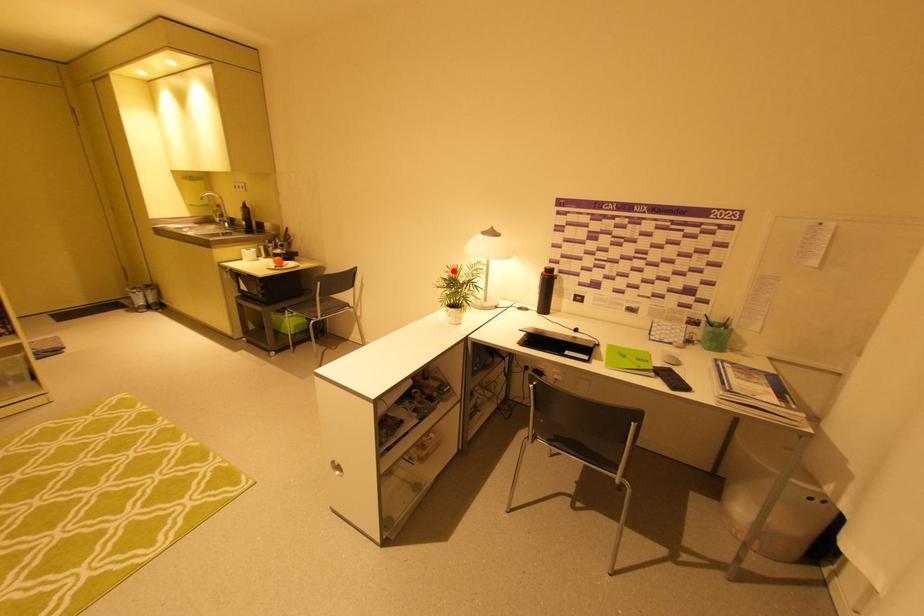
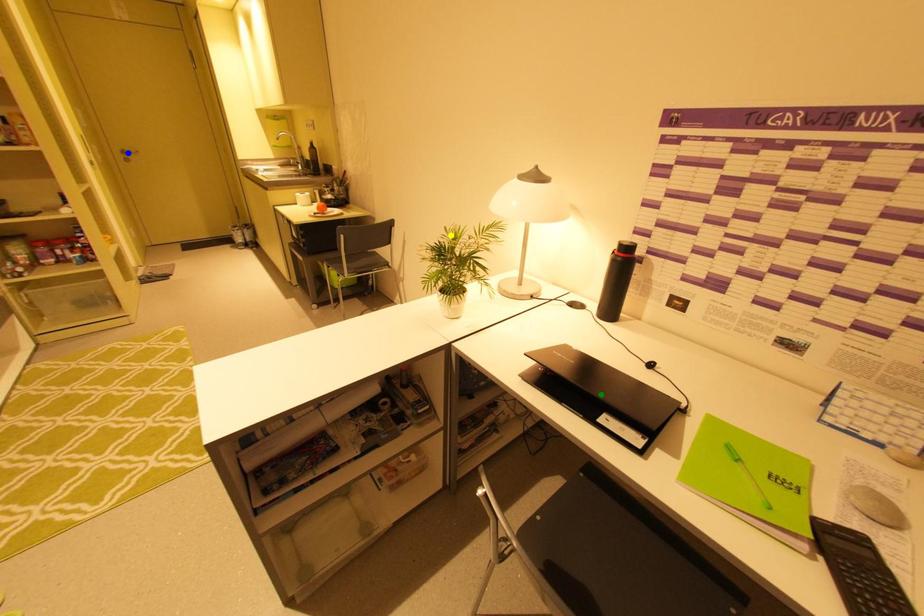
Question: I am providing you with two images of the same scene from different viewpoints. A red point is marked on the first image. You are given multiple points on the second image. Can you choose the point in image 2 that corresponds to the point in image 1?

Choices:
 (A) yellow point
 (B) green point
 (C) blue point

Answer: (A)